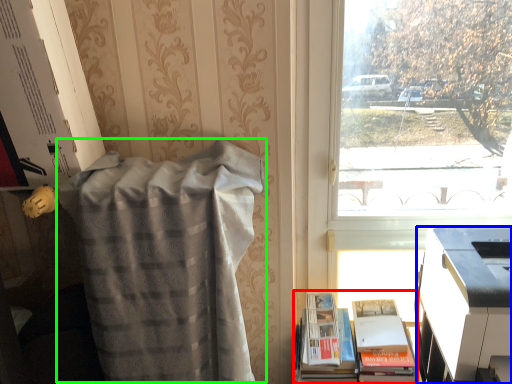
Question: Based on their relative distances, which object is farther from book (highlighted by a red box)? Choose from printer (highlighted by a blue box) and blanket (highlighted by a green box).

Choices:
 (A) printer
 (B) blanket

Answer: (B)